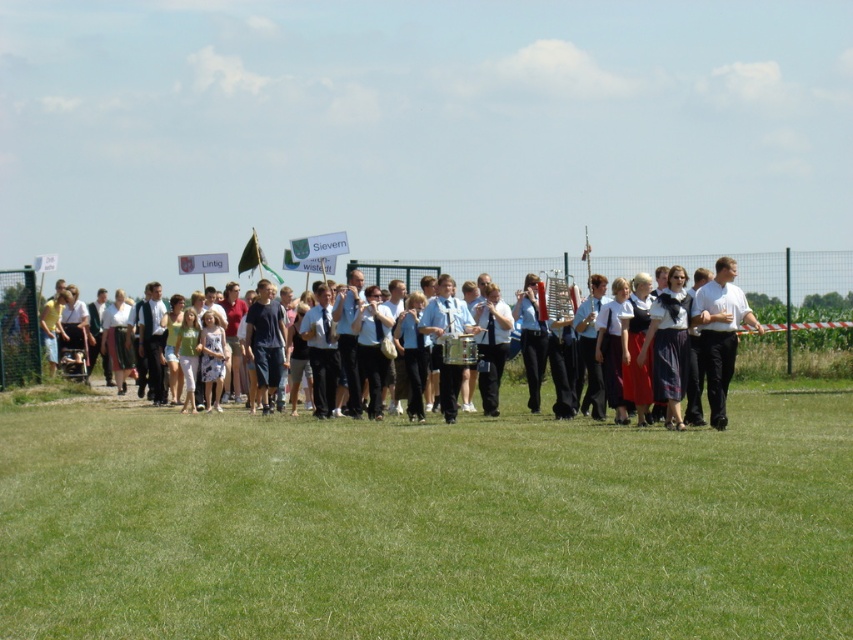
Does green grass at center come behind light blue fabric dress at center?

No, green grass at center is in front of light blue fabric dress at center.

Which of these two, green grass at center or light blue fabric dress at center, stands shorter?

Standing shorter between the two is green grass at center.

Where is `green grass at center`? Image resolution: width=853 pixels, height=640 pixels. green grass at center is located at coordinates (425, 524).

Is light blue fabric dress at center smaller than white matte shirt at center?

Actually, light blue fabric dress at center might be larger than white matte shirt at center.

In the scene shown: Who is higher up, light blue fabric dress at center or white matte shirt at center?

light blue fabric dress at center is higher up.

Locate an element on the screen. light blue fabric dress at center is located at coordinates (x=699, y=337).

Who is taller, green grass at center or white matte shirt at center?

white matte shirt at center is taller.

Between point (407, 625) and point (717, 301), which one is positioned behind?

The point (717, 301) is more distant.

This screenshot has width=853, height=640. I want to click on green grass at center, so click(425, 524).